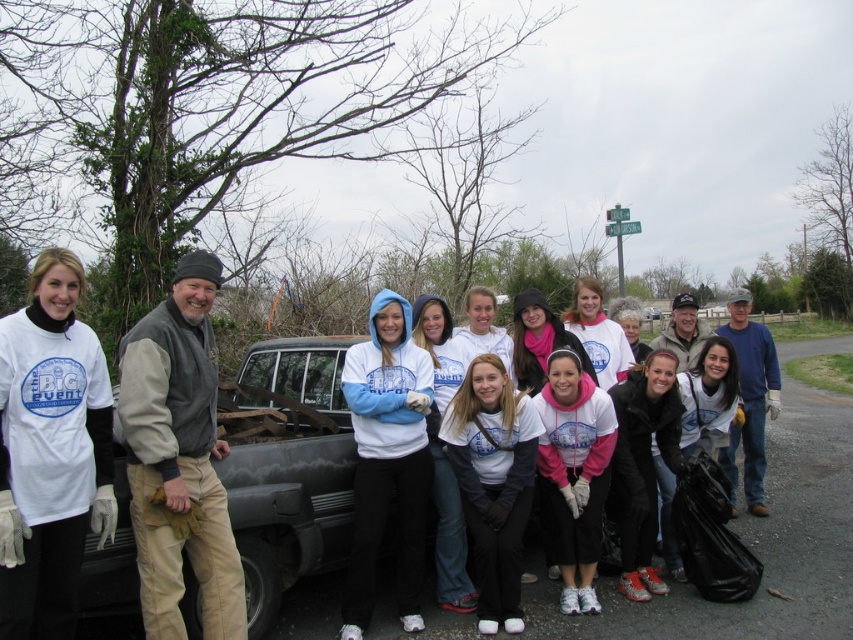
Question: Is white cotton t-shirt at center smaller than dark gray matte truck at center?

Choices:
 (A) yes
 (B) no

Answer: (A)

Question: Is white cotton t-shirt at center to the right of dark gray matte truck at center from the viewer's perspective?

Choices:
 (A) yes
 (B) no

Answer: (B)

Question: Observing the image, what is the correct spatial positioning of white cotton t-shirt at center in reference to dark gray matte truck at center?

Choices:
 (A) above
 (B) below

Answer: (A)

Question: Which object is farther from the camera taking this photo?

Choices:
 (A) white cotton t-shirt at center
 (B) dark gray matte truck at center

Answer: (B)

Question: Which point is farther to the camera?

Choices:
 (A) white cotton t-shirt at center
 (B) dark gray matte truck at center

Answer: (B)